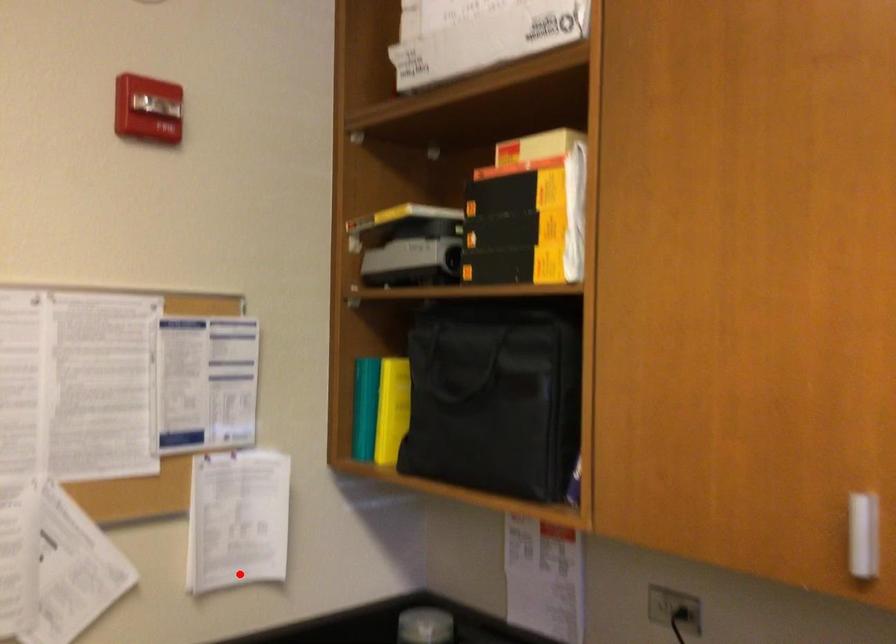
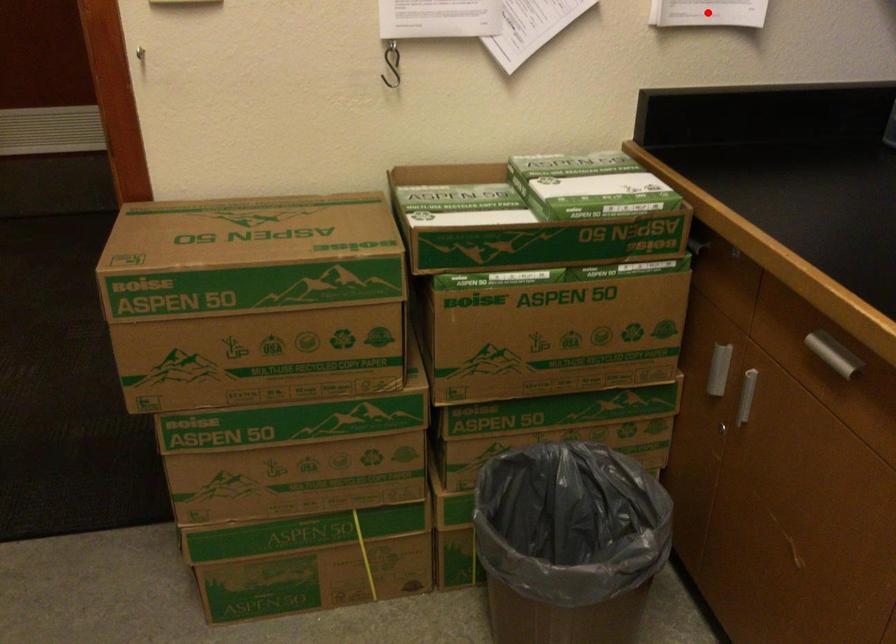
I am providing you with two images of the same scene from different viewpoints. A red point is marked on the first image and another point is marked on the second image. Do the highlighted points in image1 and image2 indicate the same real-world spot?

Yes